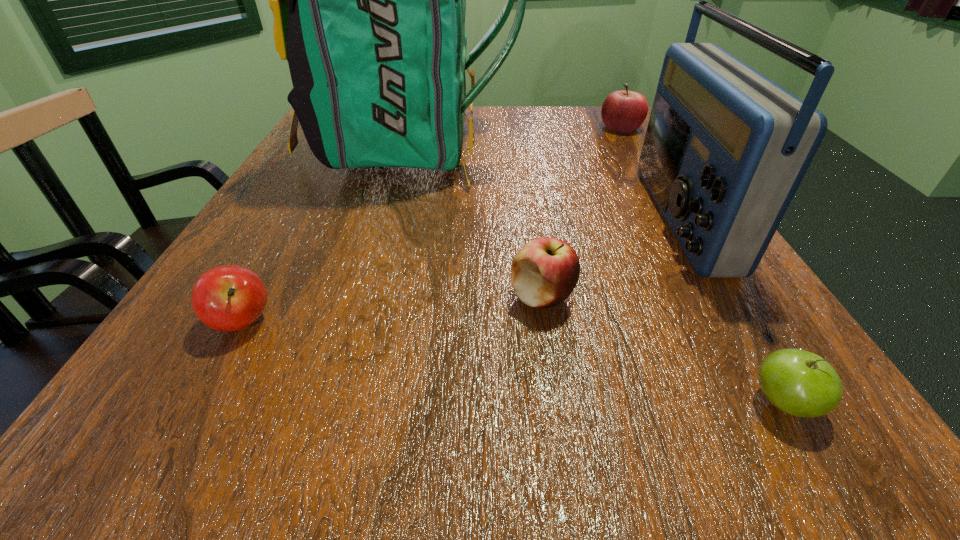
Where is `free location that satisfies the following two spatial constraints: 1. on the back side of the third apple from right to left; 2. on the back of the tallest object`? free location that satisfies the following two spatial constraints: 1. on the back side of the third apple from right to left; 2. on the back of the tallest object is located at coordinates (519, 145).

Where is `free location that satisfies the following two spatial constraints: 1. on the front side of the nearest apple; 2. on the right side of the leftmost apple`? This screenshot has width=960, height=540. free location that satisfies the following two spatial constraints: 1. on the front side of the nearest apple; 2. on the right side of the leftmost apple is located at coordinates (198, 402).

You are a GUI agent. You are given a task and a screenshot of the screen. Output one action in this format:
    pyautogui.click(x=<x>, y=<y>)
    Task: Click on the blank space that satisfies the following two spatial constraints: 1. on the back side of the second apple from left to right; 2. on the back of the tallest object
    The image size is (960, 540).
    Given the screenshot: What is the action you would take?
    pyautogui.click(x=519, y=145)

What are the coordinates of `vacant region that satisfies the following two spatial constraints: 1. on the back of the tallest object; 2. on the left side of the second apple from left to right` in the screenshot? It's located at (x=368, y=296).